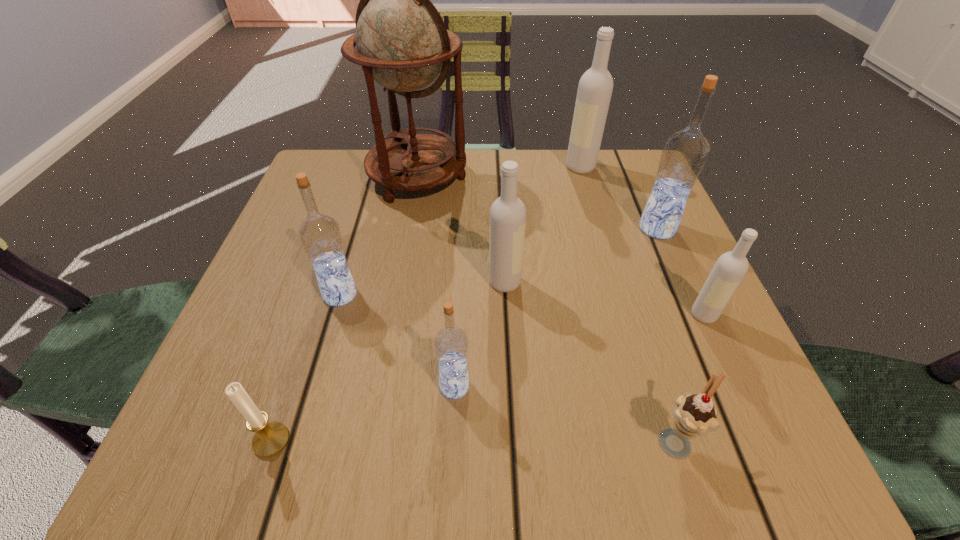
Locate an element on the screen. free space at the far left corner is located at coordinates (334, 176).

Where is `free space between the candle holder and the smallest blue vodka`? The width and height of the screenshot is (960, 540). free space between the candle holder and the smallest blue vodka is located at coordinates (363, 413).

Locate an element on the screen. This screenshot has height=540, width=960. vacant space that is in between the biggest white vodka and the leftmost white vodka is located at coordinates (542, 225).

Where is `vacant region between the smallest white vodka and the leftmost vodka`? vacant region between the smallest white vodka and the leftmost vodka is located at coordinates (522, 305).

At what (x,y) coordinates should I click in order to perform the action: click on free spot between the second white vodka from left to right and the candle holder. Please return your answer as a coordinate pair (x, y). Looking at the image, I should click on (426, 303).

Find the location of a particular element. The image size is (960, 540). unoccupied area between the second nearest white vodka and the icecream is located at coordinates (589, 361).

You are a GUI agent. You are given a task and a screenshot of the screen. Output one action in this format:
    pyautogui.click(x=<x>, y=<y>)
    Task: Click on the free space that is in between the second smallest blue vodka and the rightmost white vodka
    The width and height of the screenshot is (960, 540).
    Given the screenshot: What is the action you would take?
    pyautogui.click(x=522, y=305)

The image size is (960, 540). In order to click on free point between the rightmost white vodka and the third nearest object in this screenshot , I will do `click(579, 350)`.

Locate an element on the screen. The height and width of the screenshot is (540, 960). vacant point located between the leftmost blue vodka and the smallest blue vodka is located at coordinates (397, 340).

Where is `free spot between the globe and the icecream`? free spot between the globe and the icecream is located at coordinates (545, 309).